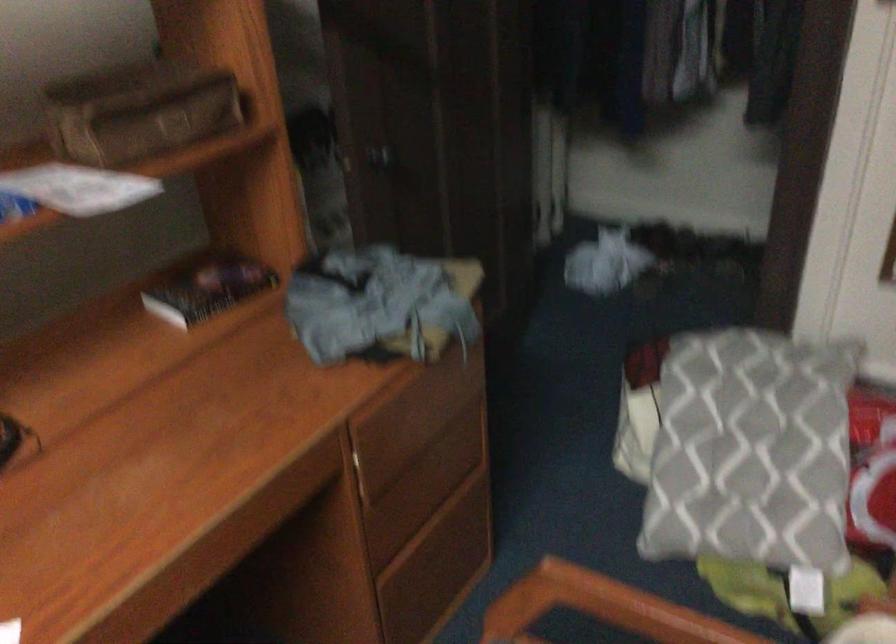
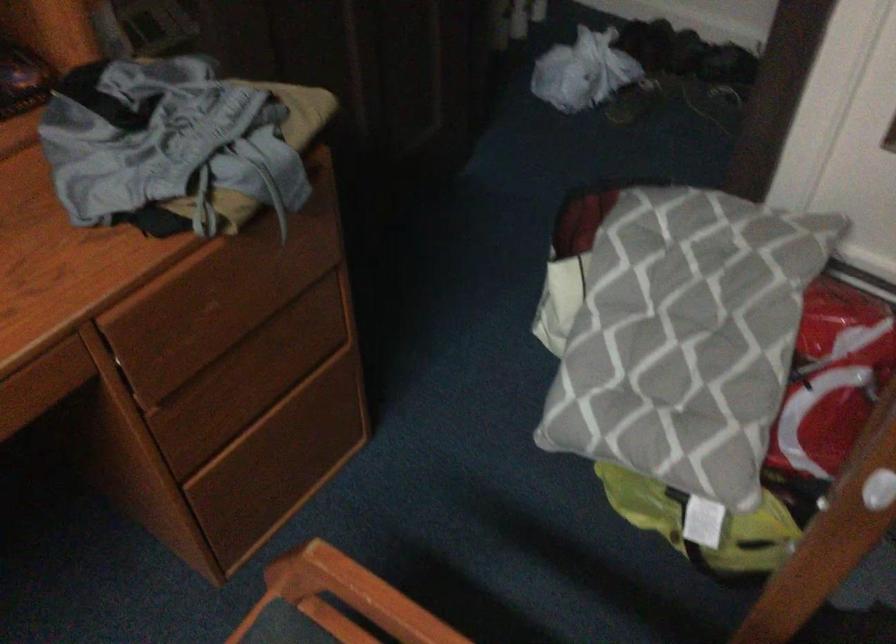
Consider the image. In a continuous first-person perspective shot, in which direction is the camera moving?

The cameraman moved toward right, forward.